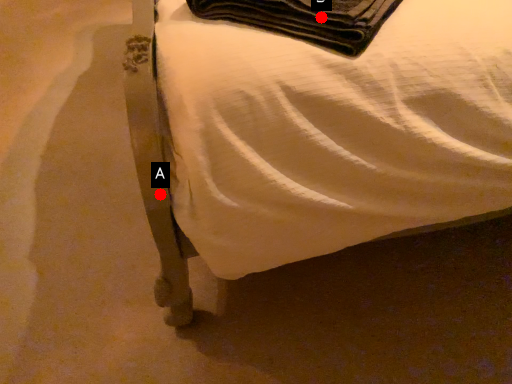
Question: Two points are circled on the image, labeled by A and B beside each circle. Which point appears farthest from the camera in this image?

Choices:
 (A) A is further
 (B) B is further

Answer: (B)